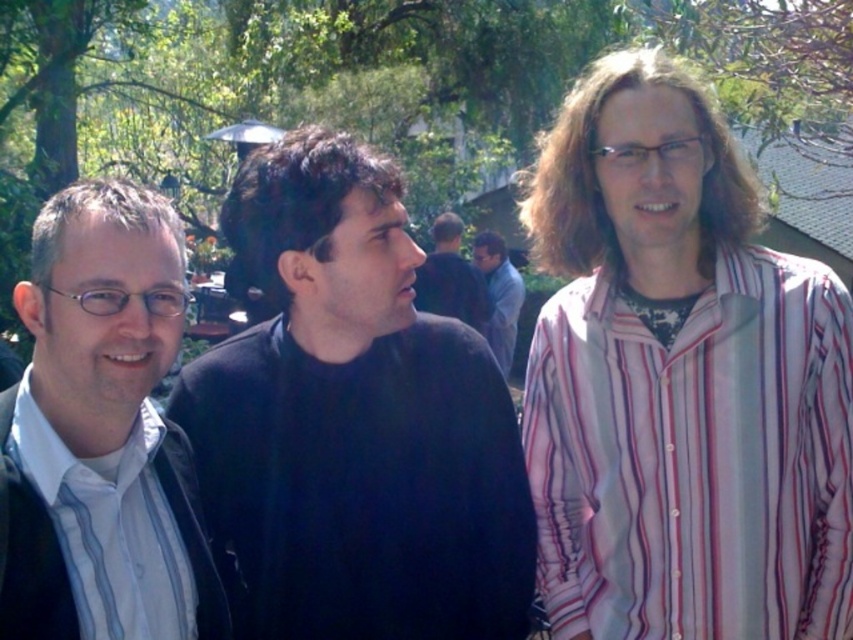
You are a photographer at the event and want to ensure the white matte shirt at left is visible in the final photo. Based on its position marked by point (103, 432), where should you focus the camera?

The point (103, 432) marks the white matte shirt at left, so focusing the camera at that coordinate will ensure the white matte shirt at left is clearly visible in the photo.

You are a photographer standing at the left side of the scene. You need to take a photo that includes both the striped cotton shirt at right and the dark blue sweater at center. Given that your camera has a maximum focus range of 5 meters, will you be able to capture both subjects in focus?

The striped cotton shirt at right and dark blue sweater at center are 5.55 meters apart from each other. Since the distance between them exceeds the camera maximum focus range of 5 meters, the photographer will not be able to capture both subjects in focus.